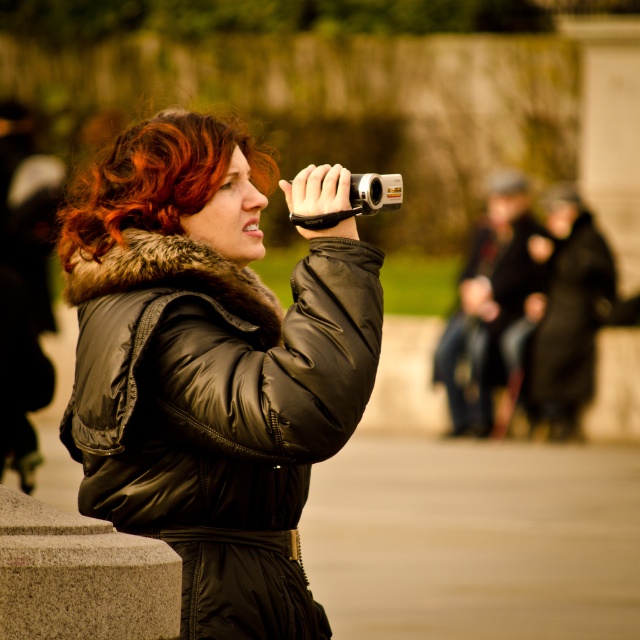
Is black leather jacket at center positioned before curly auburn hair at center?

Yes, black leather jacket at center is closer to the viewer.

Find the location of a particular element. black leather jacket at center is located at coordinates [211, 365].

You are a GUI agent. You are given a task and a screenshot of the screen. Output one action in this format:
    pyautogui.click(x=<x>, y=<y>)
    Task: Click on the black leather jacket at center
    
    Given the screenshot: What is the action you would take?
    pyautogui.click(x=211, y=365)

Does point (90, 417) lie in front of point (358, 195)?

That is True.

Is black leather jacket at center shorter than silver metallic camera at upper center?

Yes.

Image resolution: width=640 pixels, height=640 pixels. I want to click on black leather jacket at center, so click(211, 365).

Between dark gray fabric jacket at center and silver metallic camera at upper center, which one is positioned lower?

dark gray fabric jacket at center is lower down.

Who is more forward, (x=438, y=349) or (x=365, y=195)?

Point (x=365, y=195)

You are a GUI agent. You are given a task and a screenshot of the screen. Output one action in this format:
    pyautogui.click(x=<x>, y=<y>)
    Task: Click on the dark gray fabric jacket at center
    Image resolution: width=640 pixels, height=640 pixels.
    Given the screenshot: What is the action you would take?
    click(488, 301)